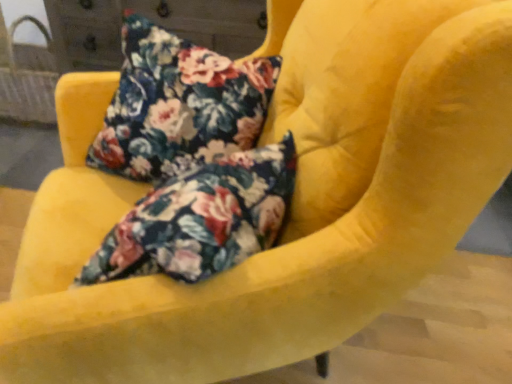
What do you see at coordinates (179, 105) in the screenshot?
I see `floral fabric pillow at upper left` at bounding box center [179, 105].

Locate an element on the screen. Image resolution: width=512 pixels, height=384 pixels. floral fabric pillow at upper left is located at coordinates (179, 105).

What are the coordinates of `floral fabric pillow at upper left` in the screenshot? It's located at (179, 105).